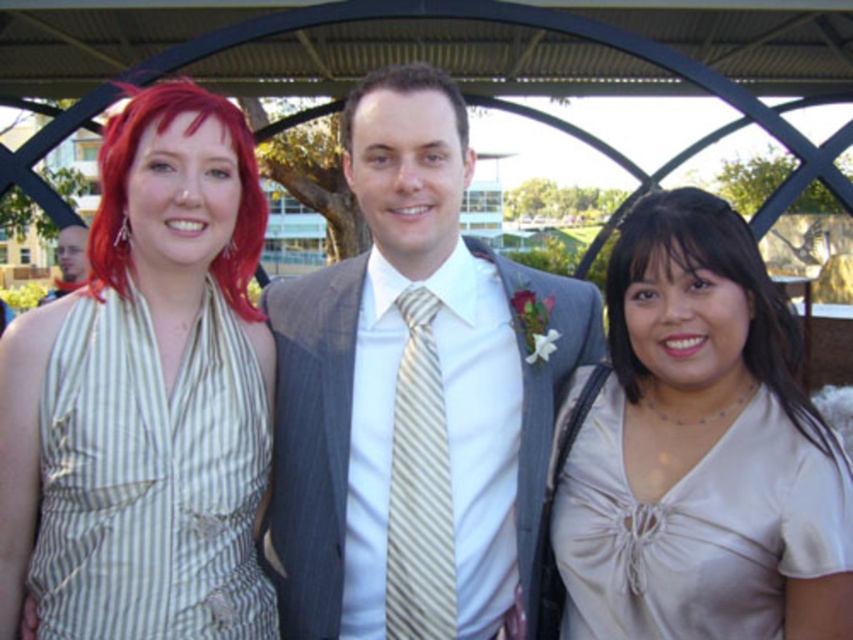
Question: Is striped fabric suit at center above brown matte hair at center?

Choices:
 (A) no
 (B) yes

Answer: (A)

Question: Based on their relative distances, which object is nearer to the matte black suit at left?

Choices:
 (A) striped silk tie at center
 (B) brown matte hair at center
 (C) vivid red hair at left
 (D) satin beige blouse at right

Answer: (C)

Question: Among these points, which one is farthest from the camera?

Choices:
 (A) (44, 294)
 (B) (250, 308)
 (C) (408, 490)
 (D) (380, 81)

Answer: (A)

Question: Does striped fabric suit at center have a smaller size compared to matte black suit at left?

Choices:
 (A) yes
 (B) no

Answer: (A)

Question: Is satin beige blouse at right smaller than matte black suit at left?

Choices:
 (A) yes
 (B) no

Answer: (A)

Question: Which is farther from the satin beige blouse at right?

Choices:
 (A) striped fabric suit at center
 (B) vivid red hair at left

Answer: (B)